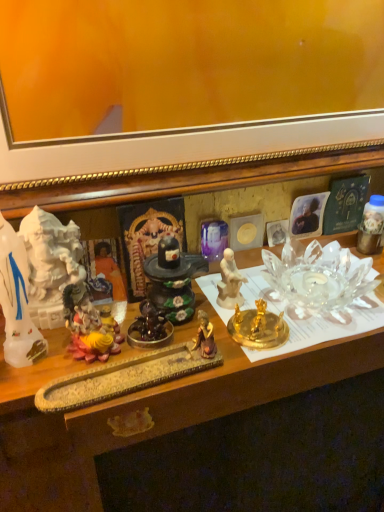
Image resolution: width=384 pixels, height=512 pixels. I want to click on free space that is in between shiny dark brown statue at center, arranged as the 4th toy when viewed from the right, and metallic gold figurine at right, positioned as the 6th toy in left-to-right order, so click(288, 295).